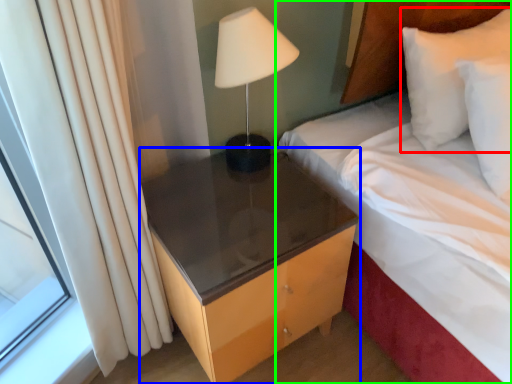
Question: Considering the real-world distances, which object is closest to pillow (highlighted by a red box)? nightstand (highlighted by a blue box) or bed (highlighted by a green box).

Choices:
 (A) nightstand
 (B) bed

Answer: (B)